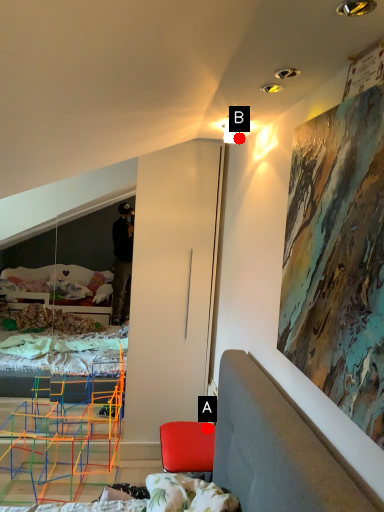
Question: Two points are circled on the image, labeled by A and B beside each circle. Which point is closer to the camera?

Choices:
 (A) A is closer
 (B) B is closer

Answer: (B)